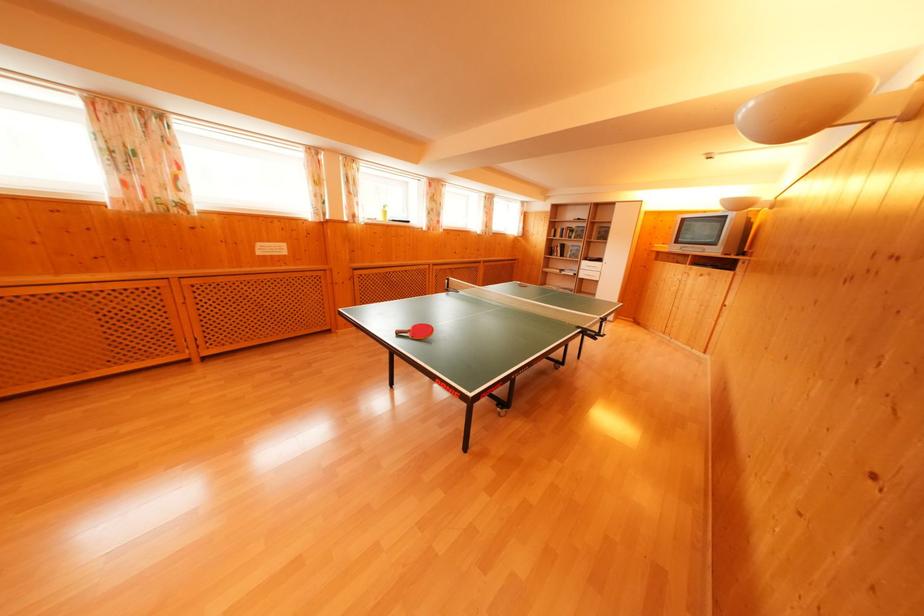
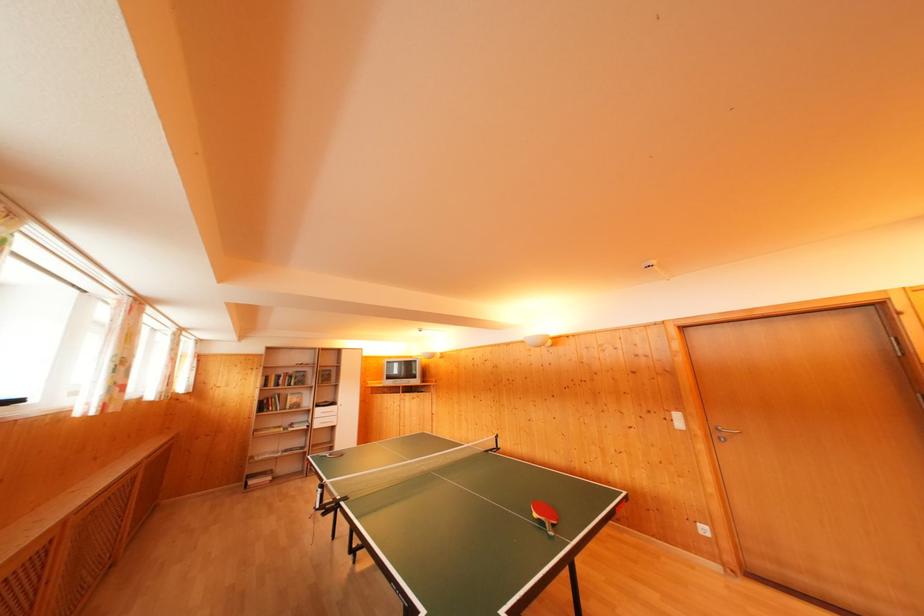
Locate, in the second image, the point that corresponds to point (554, 256) in the first image.

(268, 411)